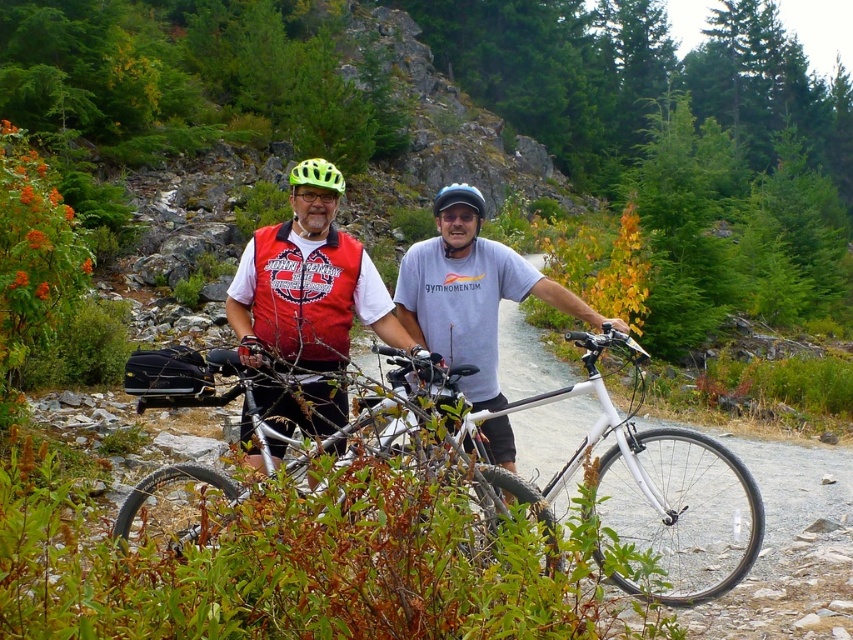
You are a photographer positioned at the camera location. You want to capture a closeup shot of the white matte mountain bike at center. Given that your camera can focus on objects within 25 feet, will you need to move closer or farther away to achieve the shot?

The white matte mountain bike at center is 28.38 feet away from the camera. Since the camera can focus within 25 feet, you need to move closer to the white matte mountain bike at center to get the closeup shot.

You are a photographer planning to take a photo of the green matte bicycle helmet at center. The camera is positioned at point (317, 173). Where should you place the focus point to ensure the helmet is in sharp focus?

Answer: The focus point should be placed at point (317, 173) where the green matte bicycle helmet at center is located to ensure it is in sharp focus.

You are a hiker who wants to cross the trail safely. There is a white matte mountain bike at center and a green matte bicycle helmet at center. Which object is closer to your path on the left side?

The green matte bicycle helmet at center is closer to your path on the left side because the white matte mountain bike at center is positioned on the right side of it.